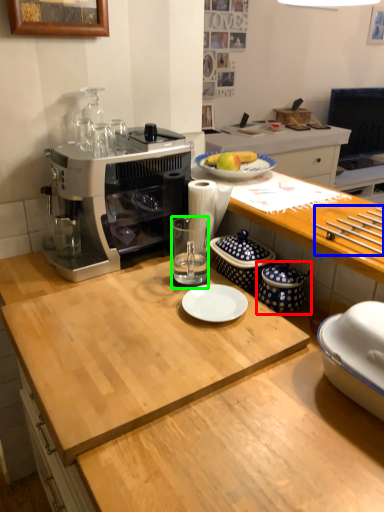
Question: Based on their relative distances, which object is nearer to appliance (highlighted by a red box)? Choose from tableware (highlighted by a blue box) and tableware (highlighted by a green box).

Choices:
 (A) tableware
 (B) tableware

Answer: (A)